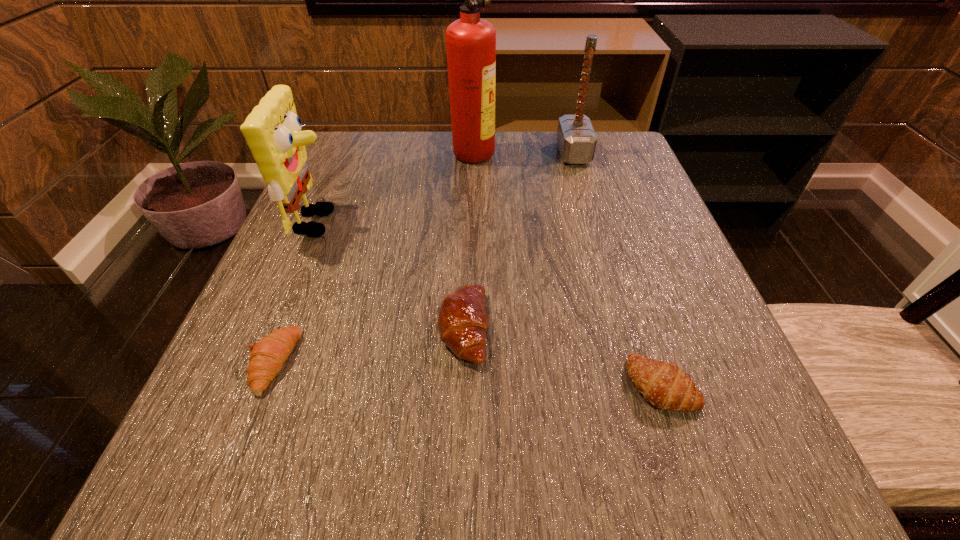
Identify the location of free space located 0.300m on the striking surface of the hammer. Image resolution: width=960 pixels, height=540 pixels. (431, 154).

You are a GUI agent. You are given a task and a screenshot of the screen. Output one action in this format:
    pyautogui.click(x=<x>, y=<y>)
    Task: Click on the vacant space located 0.270m on the face of the third farthest object
    
    Given the screenshot: What is the action you would take?
    pyautogui.click(x=479, y=222)

Where is `vacant space positioned on the left of the second crescent roll from right to left`? Image resolution: width=960 pixels, height=540 pixels. vacant space positioned on the left of the second crescent roll from right to left is located at coordinates (367, 328).

Locate an element on the screen. This screenshot has width=960, height=540. free space located 0.060m on the front of the rightmost crescent roll is located at coordinates (687, 463).

Identify the location of free space located on the right of the shortest crescent roll. (497, 362).

Find the location of `fire extinguisher that is at the far edge`. fire extinguisher that is at the far edge is located at coordinates (470, 41).

This screenshot has width=960, height=540. In order to click on hammer at the far edge in this screenshot , I will do `click(576, 138)`.

Where is `sponge that is at the left edge`? Image resolution: width=960 pixels, height=540 pixels. sponge that is at the left edge is located at coordinates click(272, 130).

This screenshot has width=960, height=540. I want to click on crescent roll situated at the left edge, so click(268, 355).

You are a GUI agent. You are given a task and a screenshot of the screen. Output one action in this format:
    pyautogui.click(x=<x>, y=<y>)
    Task: Click on the hammer that is at the right edge
    Image resolution: width=960 pixels, height=540 pixels.
    Given the screenshot: What is the action you would take?
    pyautogui.click(x=576, y=138)